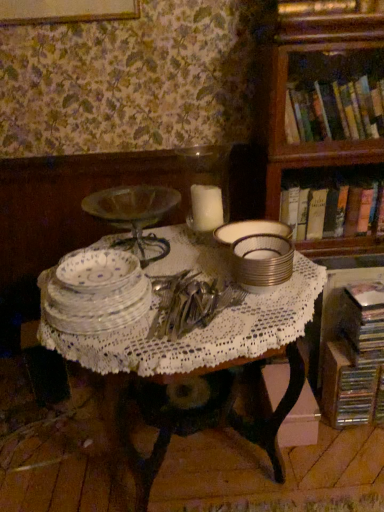
This screenshot has height=512, width=384. Find the location of `vacant space underneath white lace tablecloth at center (from a real-world perspective)`. vacant space underneath white lace tablecloth at center (from a real-world perspective) is located at coordinates (209, 460).